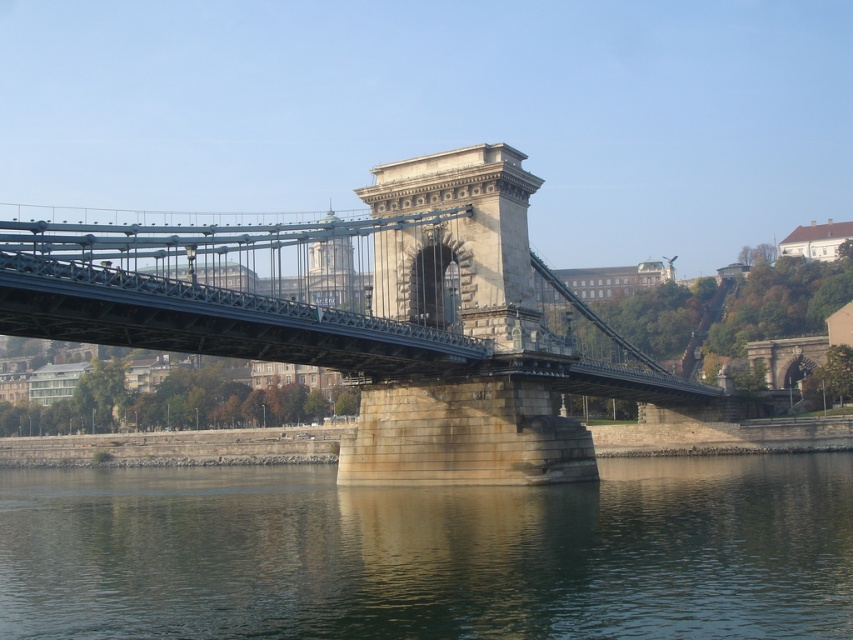
You are standing at point (27, 326) and want to walk to point (171, 490). Based on the scene, can you determine if you need to cross the suspension bridge to reach your destination?

Point (171, 490) is behind point (27, 326), so you do not need to cross the suspension bridge to reach it. You can walk directly to point (171, 490) from your current position.

You are standing on a viewing platform overlooking the river and the bridge. You notice the greenish water at lower center and the metallic stone bridge at center. Which object is nearer to you?

The greenish water at lower center is closer to the viewer than the metallic stone bridge at center, so the greenish water at lower center is nearer to you.